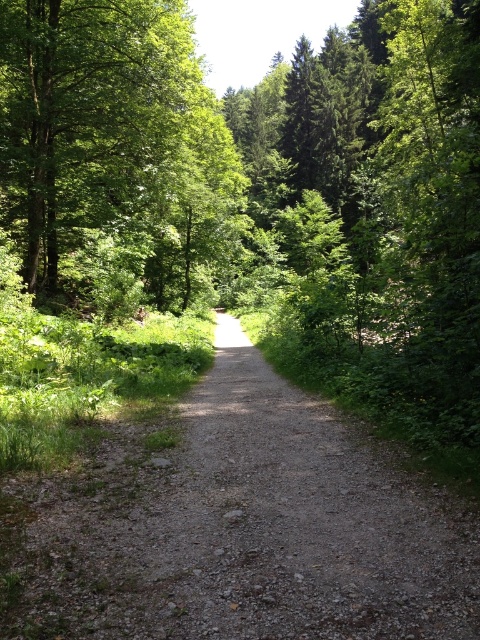
You are a hiker standing on the gray gravel path at center. You want to take a photo of the green leafy tree at upper left. Which direction should you face to get the best view of the tree?

Since the gray gravel path at center is positioned under the green leafy tree at upper left, you should face upward and to the left to look directly towards the green leafy tree at upper left.

From the picture: You are standing at the starting point of the forest path and see the point marked at coordinates (245, 528). Based on the scene description, what is the most likely surface you would be standing on at that point?

The point at coordinates (245, 528) corresponds to the gray gravel path at center, so you would be standing on the gray gravel path at center.